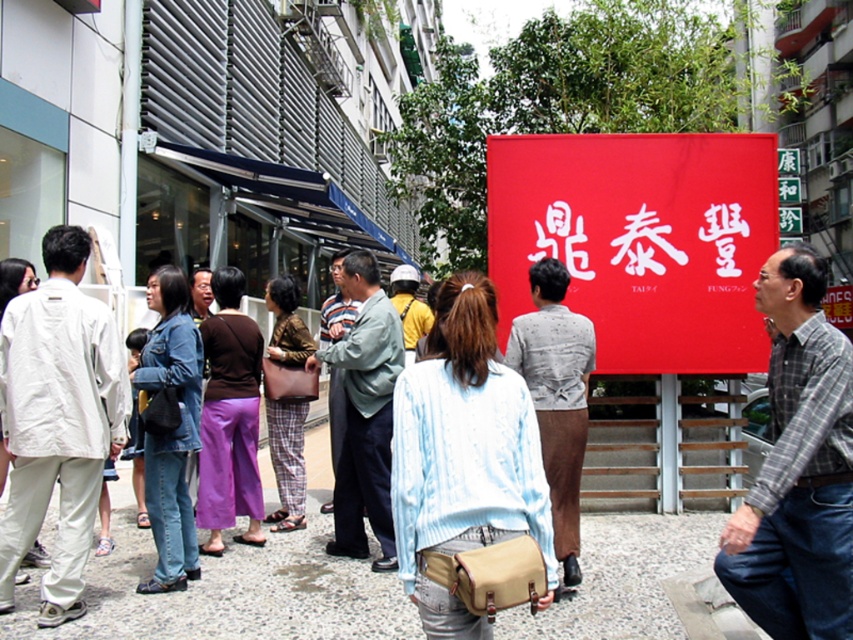
You are standing at the center of the walkway in the image. There is a red fabric sign at upper center. Can you see the point at coordinates (640, 241) from your current position?

Yes, the point at coordinates (640, 241) corresponds to the red fabric sign at upper center, so you can see it from your current position at the center of the walkway.

Based on the photo, you are a photographer trying to capture the red fabric sign at upper center and the denim jacket at center in the same frame. Which object will appear larger in your photo?

The red fabric sign at upper center will appear larger in the photo because it is bigger than the denim jacket at center.